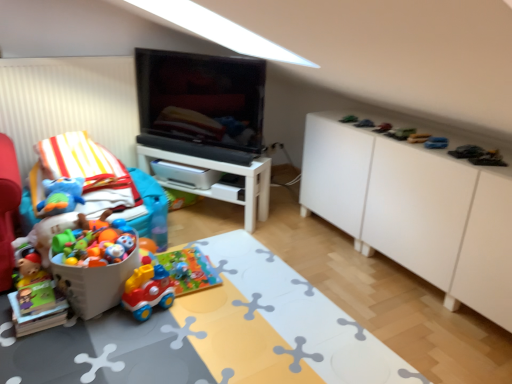
Where is `free space in front of rubber duck at upper right, placed as the fourth toy when sorted from right to left`? The width and height of the screenshot is (512, 384). free space in front of rubber duck at upper right, placed as the fourth toy when sorted from right to left is located at coordinates (429, 147).